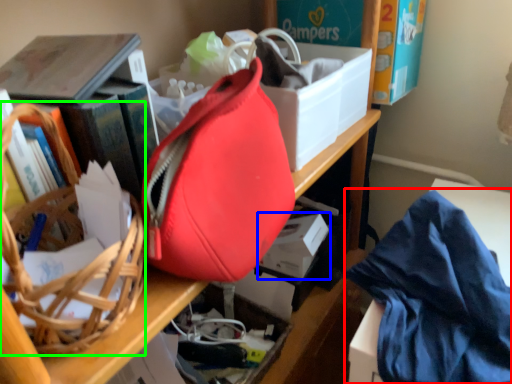
Question: Considering the real-world distances, which object is farthest from clothe (highlighted by a red box)? storage box (highlighted by a blue box) or basket (highlighted by a green box)?

Choices:
 (A) storage box
 (B) basket

Answer: (B)